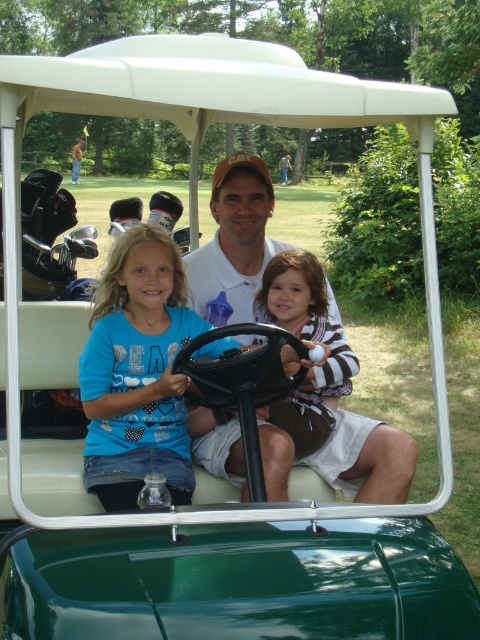
Question: Which is nearer to the blue cotton shirt at center?

Choices:
 (A) matte white shirt at center
 (B) striped fabric ball at center

Answer: (B)

Question: Estimate the real-world distances between objects in this image. Which object is farther from the matte white shirt at center?

Choices:
 (A) blue cotton shirt at center
 (B) striped fabric ball at center

Answer: (A)

Question: Is matte white shirt at center wider than striped fabric ball at center?

Choices:
 (A) no
 (B) yes

Answer: (B)

Question: Is matte white shirt at center smaller than striped fabric ball at center?

Choices:
 (A) yes
 (B) no

Answer: (A)

Question: Can you confirm if matte white shirt at center is wider than striped fabric ball at center?

Choices:
 (A) yes
 (B) no

Answer: (A)

Question: Which point is closer to the camera?

Choices:
 (A) (239, 272)
 (B) (130, 376)
 (C) (317, 406)

Answer: (B)